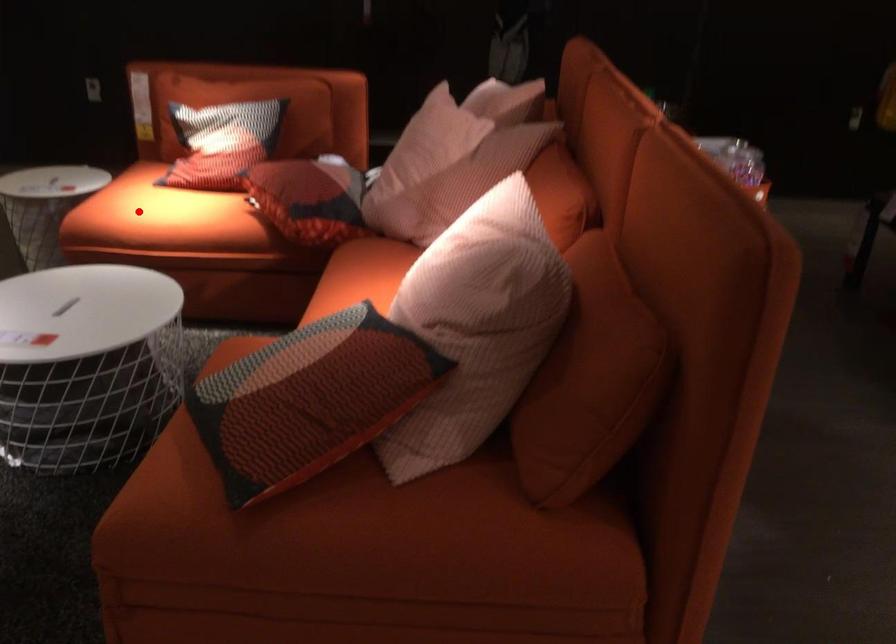
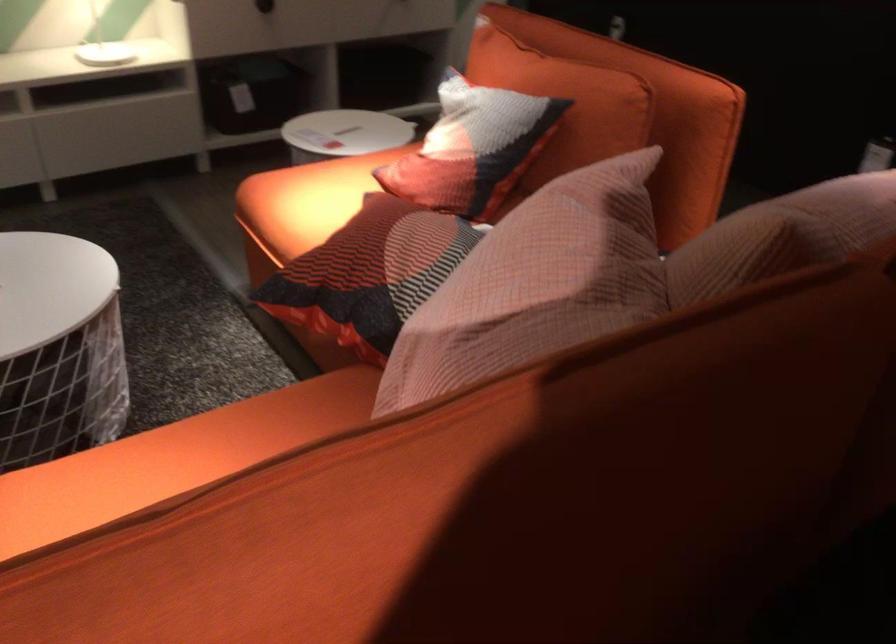
Find the pixel in the second image that matches the highlighted location in the first image.

(306, 200)